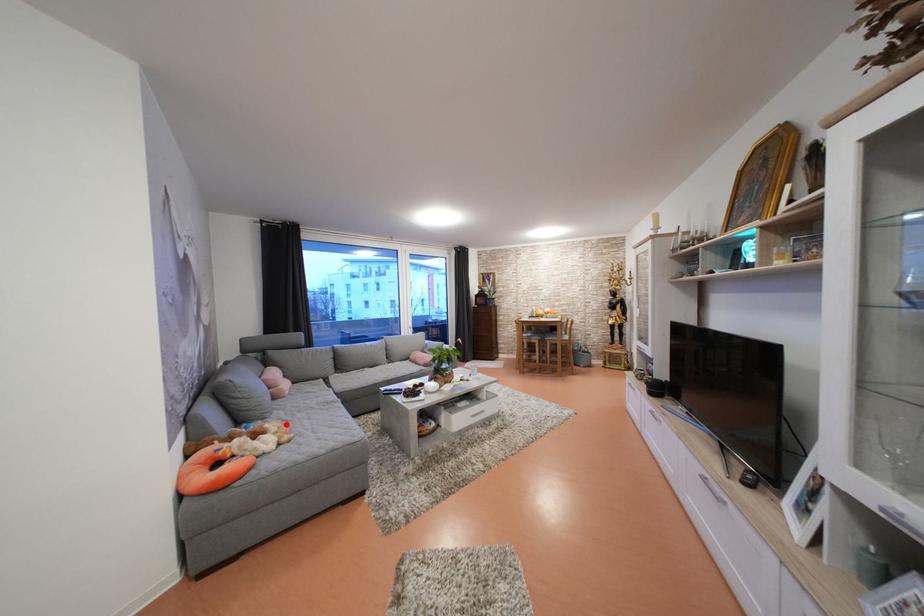
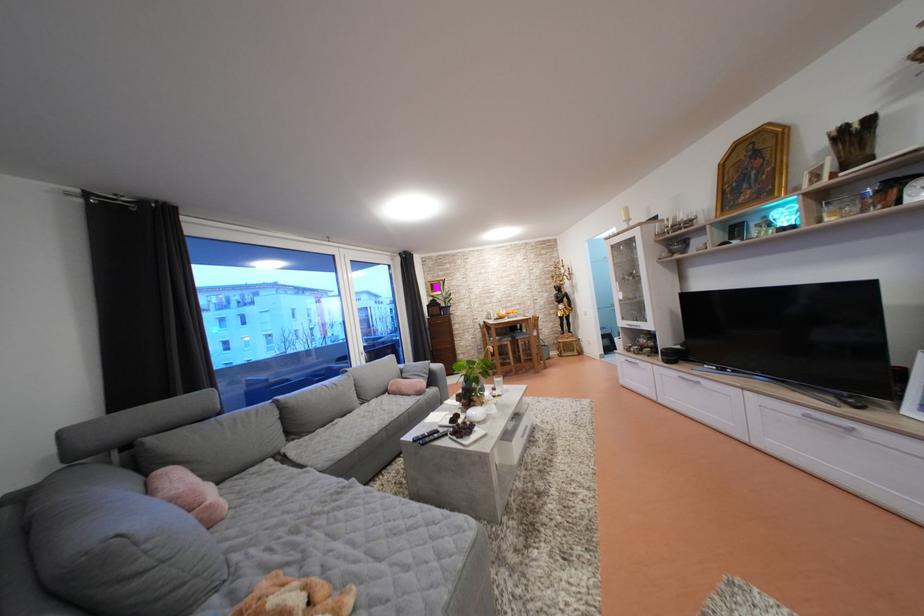
Where in the second image is the point corresponding to the highlighted location from the first image?

(274, 573)